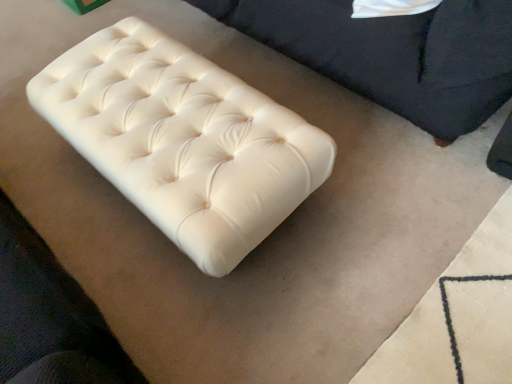
In order to click on vacant space situated above white leather ottoman at center, which appears as the 2th furniture when viewed from the right (from a real-world perspective) in this screenshot , I will do `click(152, 109)`.